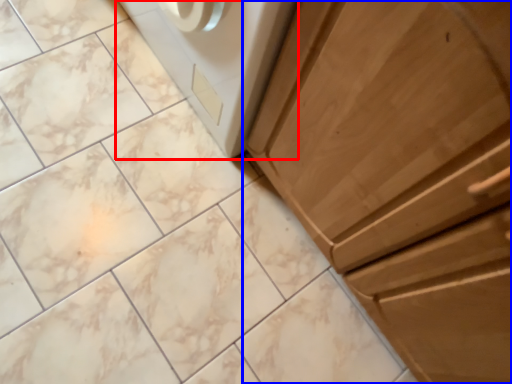
Question: Which object is closer to the camera taking this photo, home appliance (highlighted by a red box) or cabinetry (highlighted by a blue box)?

Choices:
 (A) home appliance
 (B) cabinetry

Answer: (B)